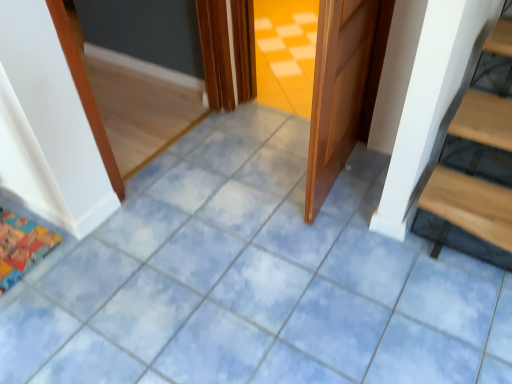
Question: Is brown wooden door at center inside or outside of cartoon fabric mat at lower left?

Choices:
 (A) outside
 (B) inside

Answer: (A)

Question: Looking at the image, does brown wooden door at center seem bigger or smaller compared to cartoon fabric mat at lower left?

Choices:
 (A) small
 (B) big

Answer: (B)

Question: Relative to cartoon fabric mat at lower left, is brown wooden door at center in front or behind?

Choices:
 (A) behind
 (B) front

Answer: (B)

Question: Considering the relative positions of cartoon fabric mat at lower left and brown wooden door at center in the image provided, is cartoon fabric mat at lower left to the left or to the right of brown wooden door at center?

Choices:
 (A) left
 (B) right

Answer: (A)

Question: Considering the positions of cartoon fabric mat at lower left and brown wooden door at center in the image, is cartoon fabric mat at lower left bigger or smaller than brown wooden door at center?

Choices:
 (A) small
 (B) big

Answer: (A)

Question: Is cartoon fabric mat at lower left taller or shorter than brown wooden door at center?

Choices:
 (A) tall
 (B) short

Answer: (B)

Question: Do you think cartoon fabric mat at lower left is within brown wooden door at center, or outside of it?

Choices:
 (A) inside
 (B) outside

Answer: (B)